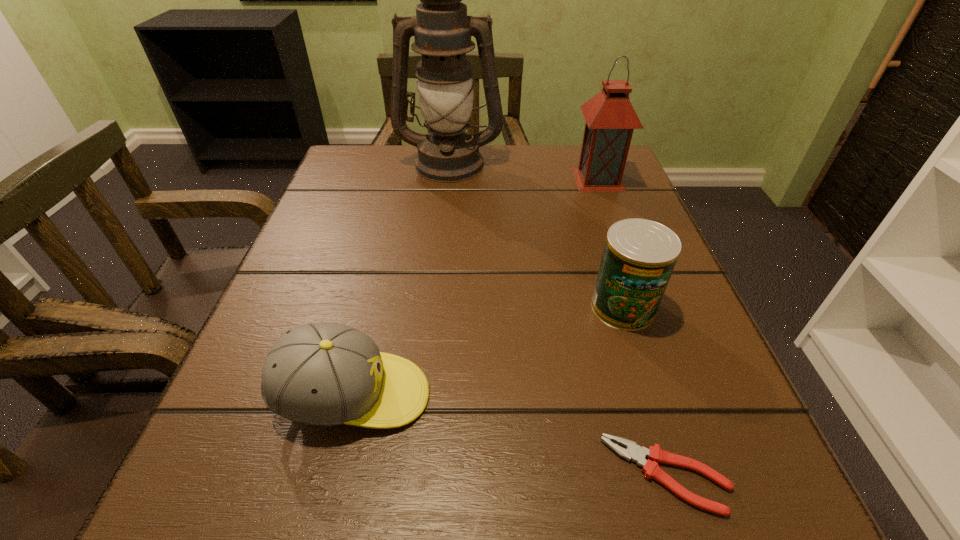
Identify the location of free spot between the second shortest object and the shortest object. (510, 435).

This screenshot has width=960, height=540. I want to click on free point between the oil lamp and the shortest object, so click(x=558, y=319).

At what (x,y) coordinates should I click in order to perform the action: click on free point between the second shortest object and the second tallest object. Please return your answer as a coordinate pair (x, y). Looking at the image, I should click on (476, 287).

Identify the location of free space between the fourth tallest object and the third tallest object. The height and width of the screenshot is (540, 960). (489, 352).

This screenshot has width=960, height=540. In order to click on unoccupied position between the oil lamp and the baseball cap in this screenshot , I will do `click(401, 279)`.

The height and width of the screenshot is (540, 960). Find the location of `vacant area that lies between the tallest object and the third farthest object`. vacant area that lies between the tallest object and the third farthest object is located at coordinates (537, 235).

This screenshot has width=960, height=540. Find the location of `free spot between the tallest object and the baseball cap`. free spot between the tallest object and the baseball cap is located at coordinates (401, 279).

What are the coordinates of `object that is the second closest to the fourth tallest object` in the screenshot? It's located at (639, 255).

Locate which object ranks third in proximity to the lantern. Please provide its 2D coordinates. Your answer should be formatted as a tuple, i.e. [(x, y)], where the tuple contains the x and y coordinates of a point satisfying the conditions above.

[(326, 374)]

The image size is (960, 540). Find the location of `vacant space that satisfies the following two spatial constraints: 1. on the front-facing side of the baseball cap; 2. on the right side of the shortest object`. vacant space that satisfies the following two spatial constraints: 1. on the front-facing side of the baseball cap; 2. on the right side of the shortest object is located at coordinates (335, 475).